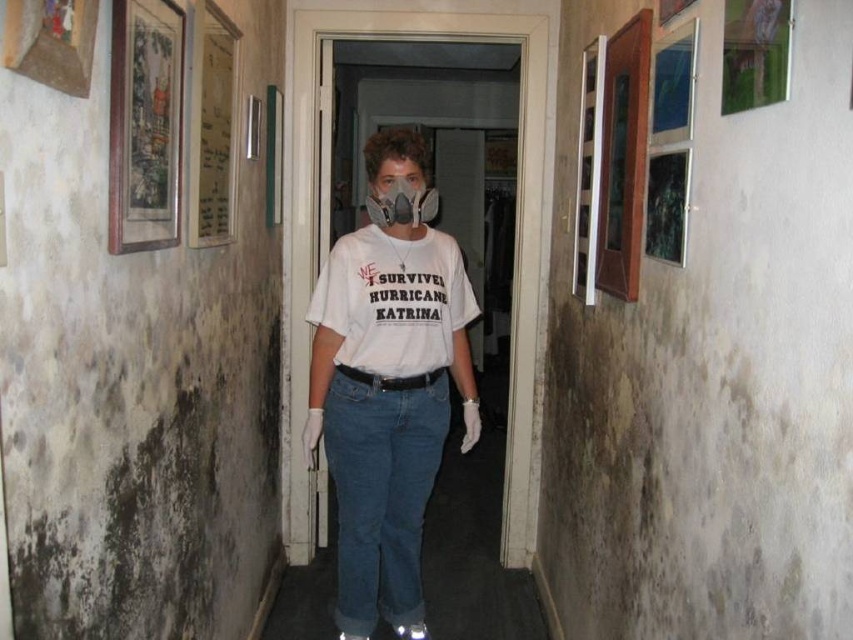
Can you confirm if white matte t-shirt at center is shorter than white cotton t-shirt at center?

No.

Who is taller, white matte t-shirt at center or white cotton t-shirt at center?

white matte t-shirt at center

Is point (419, 627) positioned in front of point (328, 276)?

No, it is not.

This screenshot has width=853, height=640. What are the coordinates of `white matte t-shirt at center` in the screenshot? It's located at (387, 406).

Which is below, white matte t-shirt at center or gray matte respirator at center?

white matte t-shirt at center is lower down.

Can you confirm if white matte t-shirt at center is positioned to the right of gray matte respirator at center?

In fact, white matte t-shirt at center is to the left of gray matte respirator at center.

Which is in front, point (465, 380) or point (412, 211)?

Point (412, 211)

Find the location of a particular element. white matte t-shirt at center is located at coordinates (387, 406).

Who is more forward, (x=405, y=272) or (x=393, y=180)?

Point (x=393, y=180)

Does white cotton t-shirt at center have a smaller size compared to gray matte respirator at center?

No.

The height and width of the screenshot is (640, 853). In order to click on white cotton t-shirt at center in this screenshot , I will do `click(393, 301)`.